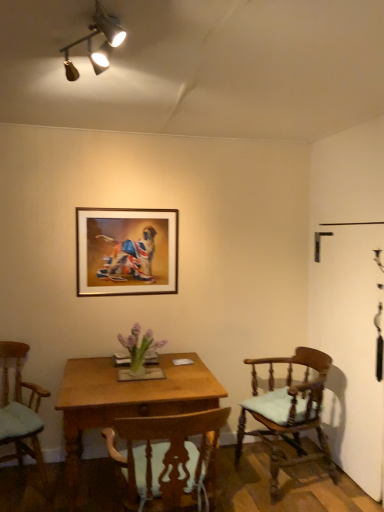
Question: Should I look upward or downward to see gold-framed picture at upper center?

Choices:
 (A) down
 (B) up

Answer: (B)

Question: Is wooden desk at center aimed at light brown wood chair at right, marked as the first chair in a right-to-left arrangement?

Choices:
 (A) yes
 (B) no

Answer: (B)

Question: Is wooden desk at center positioned beyond the bounds of light brown wood chair at right, which is the third chair in left-to-right order?

Choices:
 (A) no
 (B) yes

Answer: (B)

Question: From a real-world perspective, is wooden desk at center positioned over light brown wood chair at right, which is the third chair in left-to-right order, based on gravity?

Choices:
 (A) yes
 (B) no

Answer: (B)

Question: Is wooden desk at center in contact with light brown wood chair at right, which is the third chair in left-to-right order?

Choices:
 (A) yes
 (B) no

Answer: (B)

Question: Does wooden desk at center have a greater height compared to light brown wood chair at right, marked as the first chair in a right-to-left arrangement?

Choices:
 (A) no
 (B) yes

Answer: (A)

Question: Is the depth of wooden desk at center less than that of light brown wood chair at right, which is the third chair in left-to-right order?

Choices:
 (A) no
 (B) yes

Answer: (B)

Question: Does light green fabric chair at lower left, the first chair viewed from the left, have a greater width compared to gold-framed picture at upper center?

Choices:
 (A) no
 (B) yes

Answer: (B)

Question: Is the surface of light green fabric chair at lower left, the third chair positioned from the right, in direct contact with gold-framed picture at upper center?

Choices:
 (A) yes
 (B) no

Answer: (B)

Question: From a real-world perspective, is light green fabric chair at lower left, the third chair positioned from the right, positioned under gold-framed picture at upper center based on gravity?

Choices:
 (A) yes
 (B) no

Answer: (A)

Question: Can you confirm if light green fabric chair at lower left, the third chair positioned from the right, is smaller than gold-framed picture at upper center?

Choices:
 (A) yes
 (B) no

Answer: (B)

Question: Is light green fabric chair at lower left, the first chair viewed from the left, positioned behind gold-framed picture at upper center?

Choices:
 (A) yes
 (B) no

Answer: (B)

Question: Is light green fabric chair at lower left, the first chair viewed from the left, to the right of gold-framed picture at upper center from the viewer's perspective?

Choices:
 (A) yes
 (B) no

Answer: (B)

Question: Is light brown wood chair at right, which is the third chair in left-to-right order, to the left of gold-framed picture at upper center from the viewer's perspective?

Choices:
 (A) yes
 (B) no

Answer: (B)